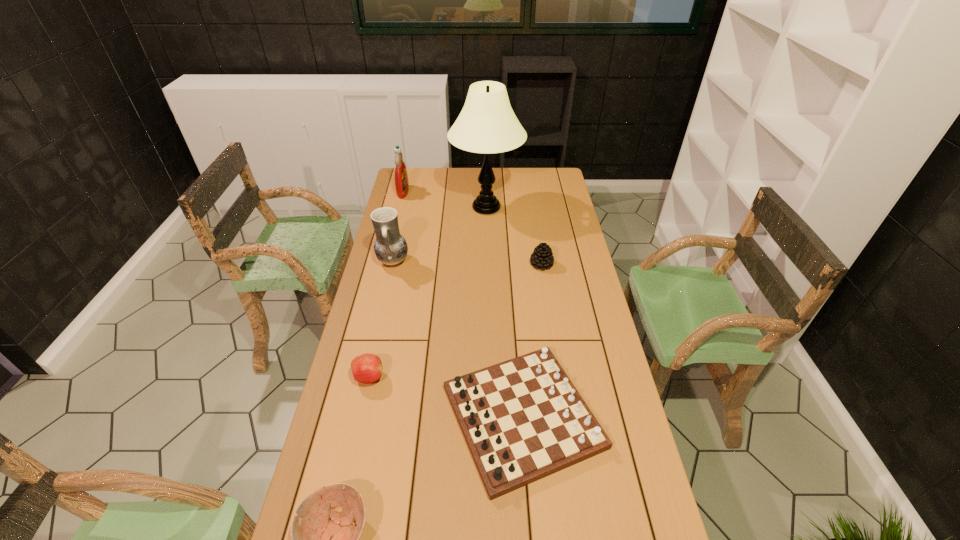
This screenshot has width=960, height=540. What are the coordinates of `the tallest object` in the screenshot? It's located at (487, 124).

I want to click on detergent, so click(401, 177).

Identify the location of pottery. (390, 247).

Find the location of a particular element. The image size is (960, 540). pinecone is located at coordinates (542, 257).

I want to click on apple, so click(367, 368).

Identify the location of chessboard. This screenshot has width=960, height=540. (523, 419).

Find the location of a particular element. The image size is (960, 540). free region located on the front of the lamp is located at coordinates (488, 256).

Locate an element on the screen. This screenshot has width=960, height=540. vacant space located on the front surface of the detergent is located at coordinates [x=423, y=192].

Locate an element on the screen. This screenshot has width=960, height=540. vacant space located 0.380m on the back of the pottery is located at coordinates (407, 200).

Locate an element on the screen. The width and height of the screenshot is (960, 540). blank area located at the narrow end of the pinecone is located at coordinates (555, 349).